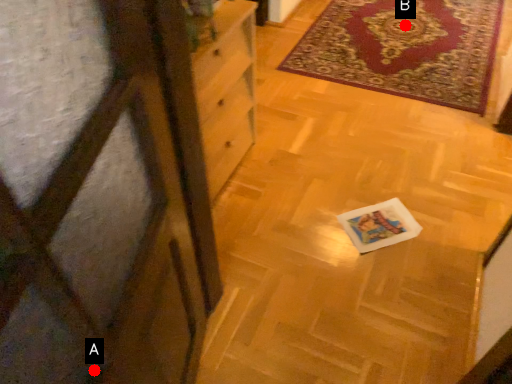
Question: Two points are circled on the image, labeled by A and B beside each circle. Which point is further to the camera?

Choices:
 (A) A is further
 (B) B is further

Answer: (B)